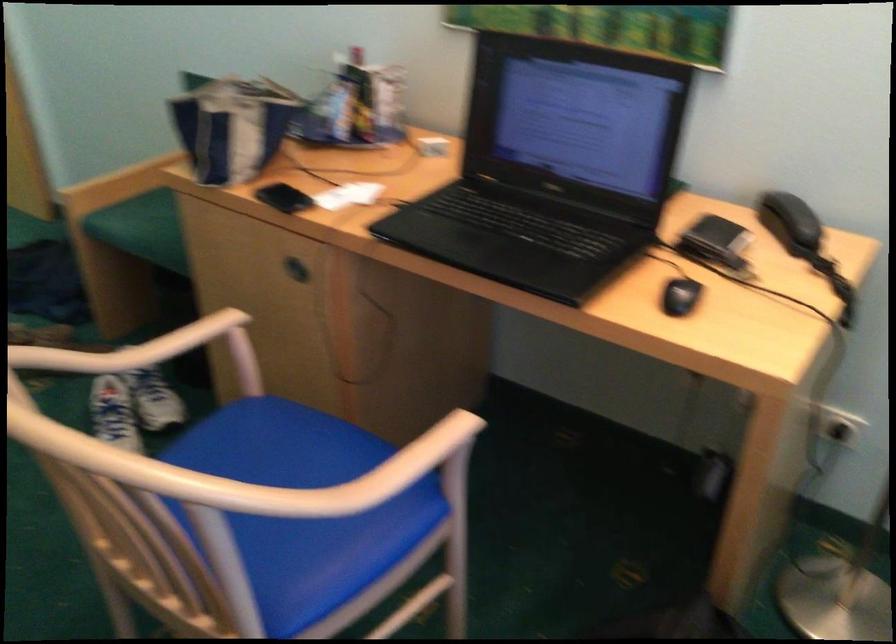
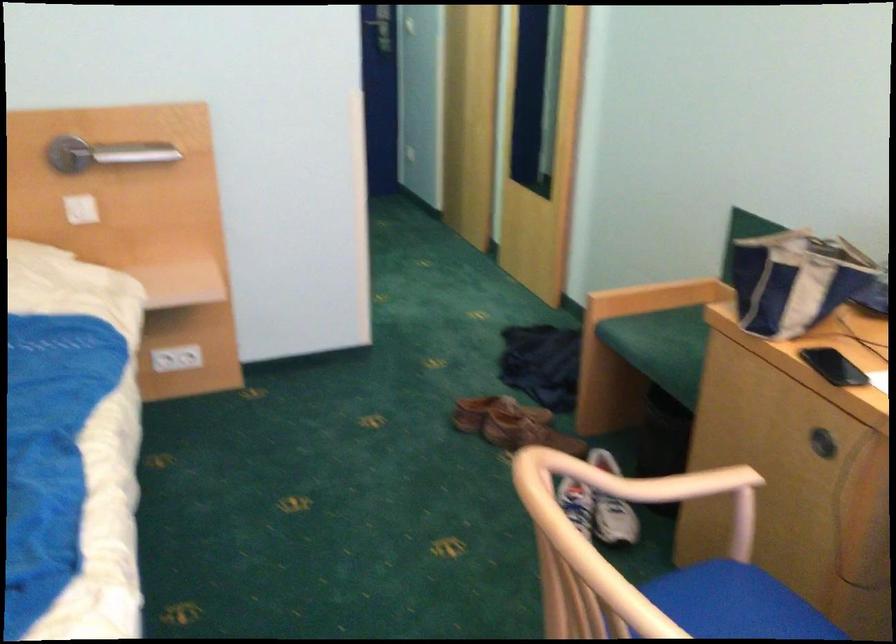
Question: The camera is either moving clockwise (left) or counter-clockwise (right) around the object. The first image is from the beginning of the video and the second image is from the end. Is the camera moving left or right when shooting the video?

Choices:
 (A) Left
 (B) Right

Answer: (B)